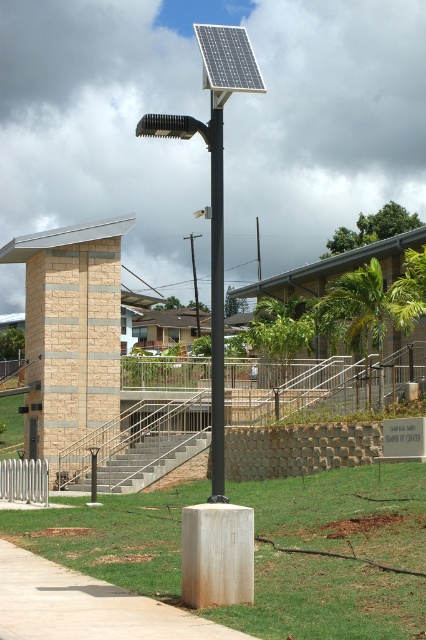
You are standing directly in front of the black matte solar panel at center. If you look straight ahead, which direction would the solar panel be relative to you?

The black matte solar panel at center is positioned at point (213, 189), so it is directly in front of you.

You are an engineer inspecting the solar panels in the image. You notice two solar panels, the black matte solar panel at center and the silver textured solar panel at upper center. Which one do you think has a bigger surface area?

The black matte solar panel at center has a larger size compared to the silver textured solar panel at upper center, so it has a bigger surface area.